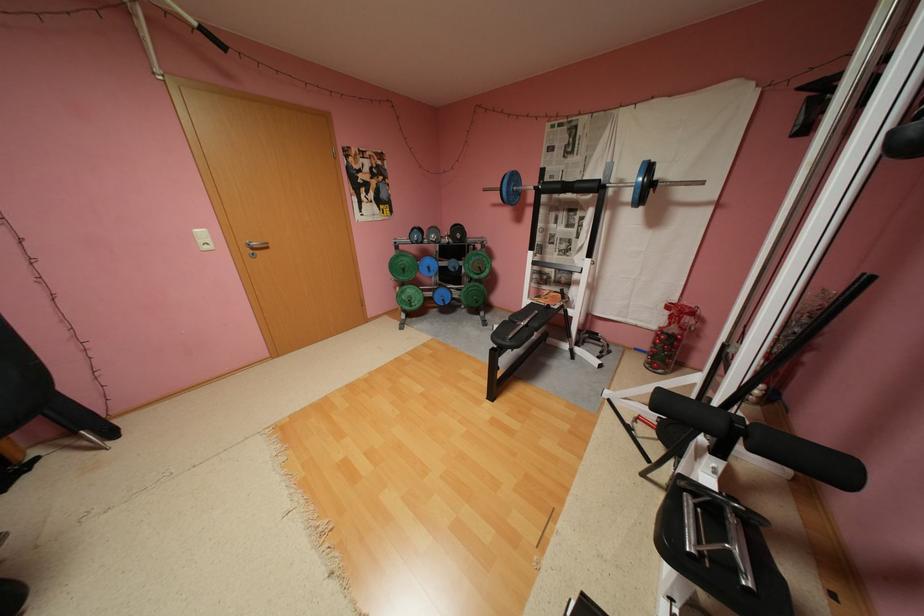
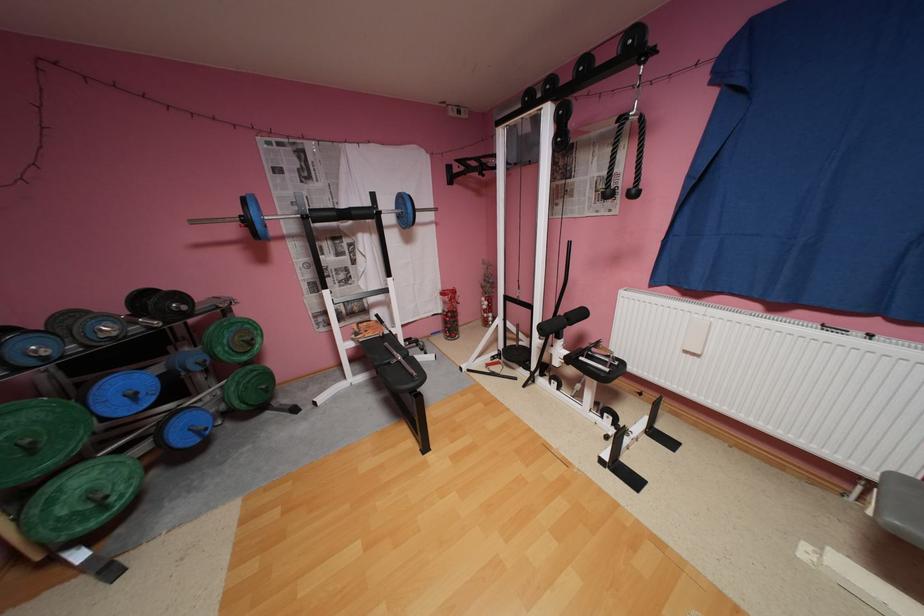
Locate, in the second image, the point that corresponds to pixel 551 302 in the first image.

(380, 334)